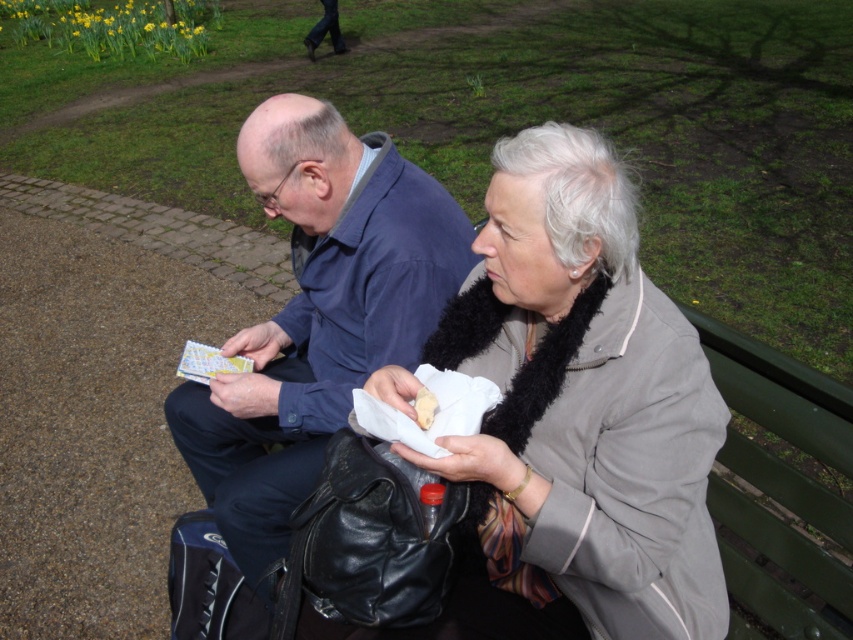
The height and width of the screenshot is (640, 853). I want to click on light gray fabric jacket at center, so click(x=579, y=412).

Does light gray fabric jacket at center have a lesser width compared to white paper napkin at lower center?

No.

Which is behind, point (567, 257) or point (433, 403)?

Point (433, 403)

Find the location of a particular element. This screenshot has height=640, width=853. light gray fabric jacket at center is located at coordinates [579, 412].

Which is more to the left, light gray fabric jacket at center or blue fabric jacket at center?

blue fabric jacket at center is more to the left.

Find the location of a particular element. This screenshot has height=640, width=853. light gray fabric jacket at center is located at coordinates (579, 412).

Is point (310, 358) positioned behind point (418, 400)?

Yes, point (310, 358) is behind point (418, 400).

Who is higher up, blue fabric jacket at center or white paper napkin at lower center?

Positioned higher is blue fabric jacket at center.

In order to click on blue fabric jacket at center in this screenshot , I will do `click(316, 314)`.